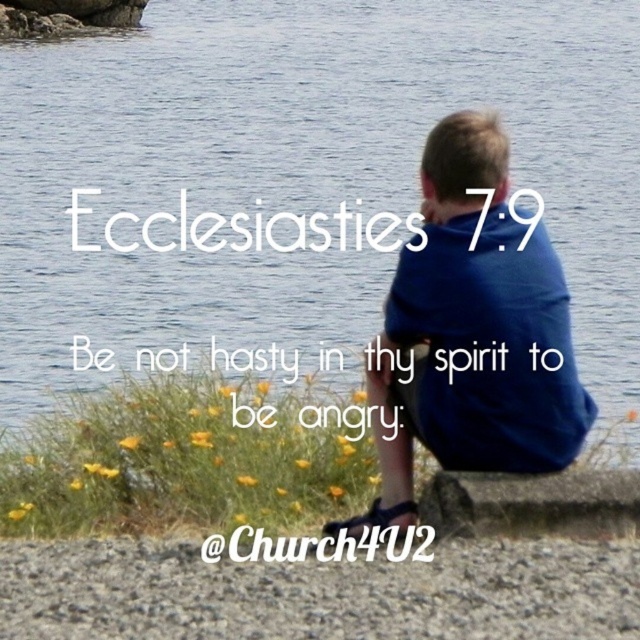
You are a photographer planning to take a photo of the transparent water at center and the smooth gray stone at lower center. Which object should you focus on first if you want to capture both in sharp focus?

The smooth gray stone at lower center should be focused on first because it is closer to the camera than the transparent water at center, which is further away. By focusing on the closer object, you can ensure both are in focus using the depth of field.

In the serene outdoor scene by the water, you notice a blue fabric shirt at center and a smooth gray stone at lower center. Which object is positioned to the right side of the other?

The smooth gray stone at lower center is to the right of the blue fabric shirt at center.